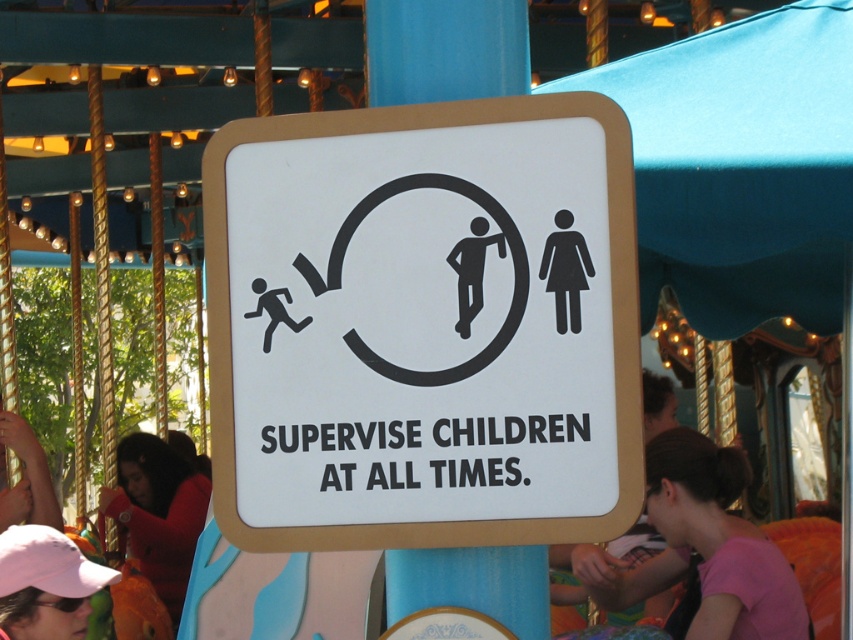
Does blue plastic pole at center have a larger size compared to red shirt at lower left?

No, blue plastic pole at center is not bigger than red shirt at lower left.

Between blue plastic pole at center and red shirt at lower left, which one is positioned lower?

red shirt at lower left is below.

Who is more distant from viewer, [511,42] or [161,513]?

The point [161,513] is more distant.

Find the location of a particular element. blue plastic pole at center is located at coordinates (445, 49).

Between pink fabric shirt at lower right and red shirt at lower left, which one is positioned lower?

red shirt at lower left is lower down.

Is point (686, 632) positioned before point (154, 451)?

That is True.

Between point (747, 588) and point (149, 548), which one is positioned in front?

Point (747, 588)

Locate an element on the screen. Image resolution: width=853 pixels, height=640 pixels. pink fabric shirt at lower right is located at coordinates (703, 547).

Who is lower down, white plastic sign at center or blue plastic pole at center?

white plastic sign at center

Who is taller, white plastic sign at center or blue plastic pole at center?

With more height is white plastic sign at center.

Find the location of `white plastic sign at center`. white plastic sign at center is located at coordinates (424, 324).